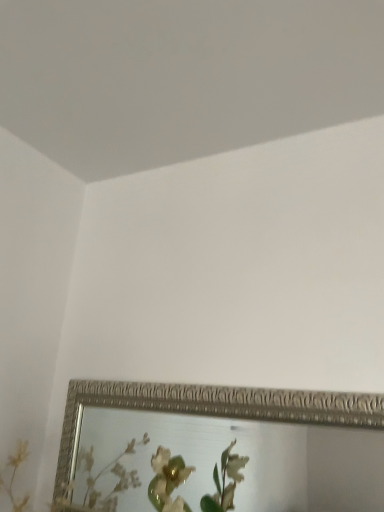
In order to face silver textured mirror at lower center, should I rotate leftwards or rightwards?

Rotate your view left by about 0.761°.

What do you see at coordinates (219, 449) in the screenshot? I see `silver textured mirror at lower center` at bounding box center [219, 449].

Identify the location of silver textured mirror at lower center. [x=219, y=449].

Find the location of a particular element. This screenshot has width=384, height=512. silver textured mirror at lower center is located at coordinates (219, 449).